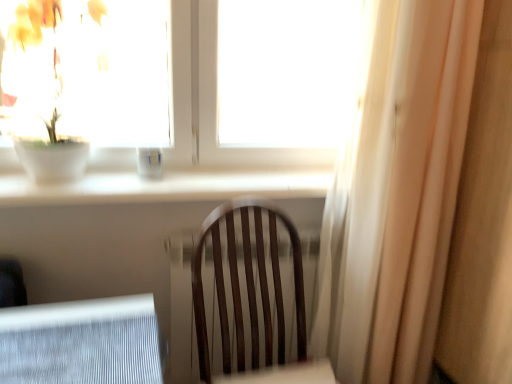
Question: In the image, is transparent glass window at upper center positioned in front of or behind white sheer curtain at right?

Choices:
 (A) front
 (B) behind

Answer: (B)

Question: Does point (261, 87) appear closer or farther from the camera than point (334, 248)?

Choices:
 (A) farther
 (B) closer

Answer: (A)

Question: Which object is positioned closest to the transparent glass window at upper center?

Choices:
 (A) white sheer curtain at right
 (B) green matte plant at upper left

Answer: (B)

Question: Estimate the real-world distances between objects in this image. Which object is closer to the transparent glass window at upper center?

Choices:
 (A) green matte plant at upper left
 (B) white sheer curtain at right

Answer: (A)